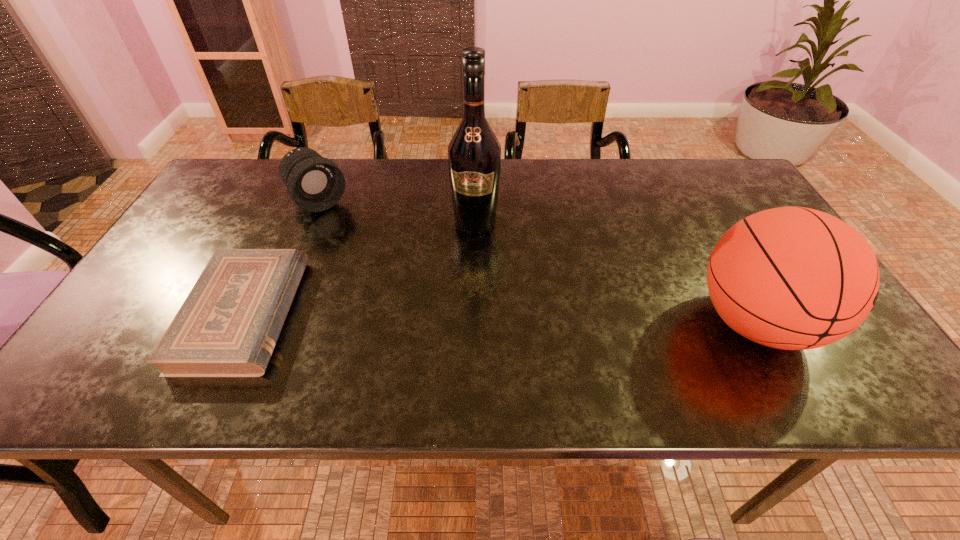
Find the location of a particular element. The height and width of the screenshot is (540, 960). free space between the telephoto lens and the tallest object is located at coordinates (397, 212).

You are a GUI agent. You are given a task and a screenshot of the screen. Output one action in this format:
    pyautogui.click(x=<x>, y=<y>)
    Task: Click on the closest object to the second shortest object
    The width and height of the screenshot is (960, 540).
    Given the screenshot: What is the action you would take?
    pyautogui.click(x=228, y=326)

Locate which object ranks third in proximity to the second shortest object. Please provide its 2D coordinates. Your answer should be formatted as a tuple, i.e. [(x, y)], where the tuple contains the x and y coordinates of a point satisfying the conditions above.

[(793, 278)]

Locate an element on the screen. free point that satisfies the following two spatial constraints: 1. on the front side of the telephoto lens; 2. on the right side of the second object from right to left is located at coordinates (309, 223).